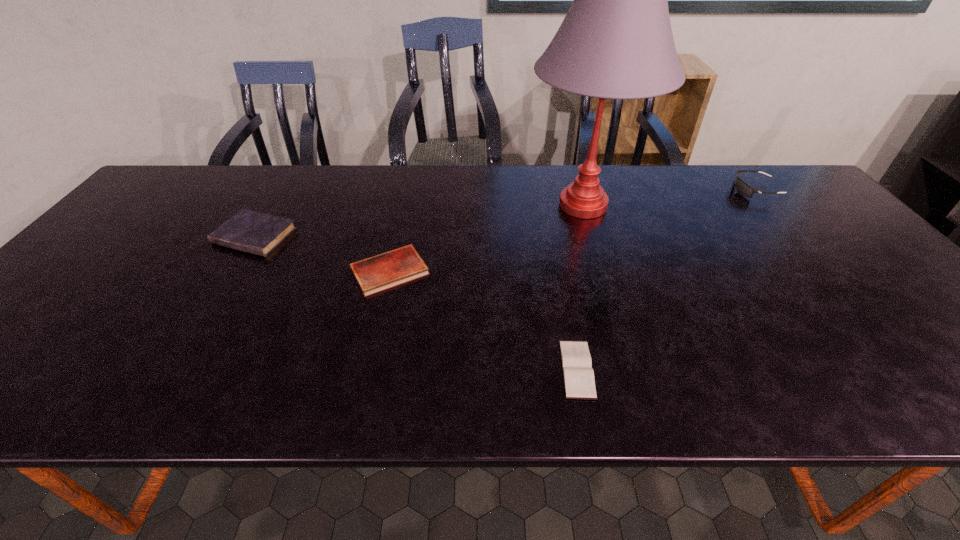
At what (x,y) coordinates should I click in order to perform the action: click on free region located on the front-facing side of the table lamp. Please return your answer as a coordinate pair (x, y). This screenshot has height=540, width=960. Looking at the image, I should click on (493, 205).

The width and height of the screenshot is (960, 540). I want to click on free spot located on the lenses of the rightmost object, so click(674, 190).

Locate an element on the screen. vacant space located 0.280m on the lenses of the rightmost object is located at coordinates (641, 190).

Where is `free space located 0.240m on the lenses of the rightmost object`? This screenshot has height=540, width=960. free space located 0.240m on the lenses of the rightmost object is located at coordinates (655, 190).

Image resolution: width=960 pixels, height=540 pixels. I want to click on free space located on the right of the tallest diary, so click(x=326, y=236).

The height and width of the screenshot is (540, 960). I want to click on vacant space located 0.390m on the left of the second diary from right to left, so click(191, 271).

Identify the location of free space located 0.320m on the left of the rightmost diary. The image size is (960, 540). (400, 369).

Locate an element on the screen. This screenshot has width=960, height=540. table lamp situated at the far edge is located at coordinates (615, 42).

Where is `goggles at the far edge`? This screenshot has height=540, width=960. goggles at the far edge is located at coordinates (743, 188).

Identify the location of object that is at the near edge. The width and height of the screenshot is (960, 540). (578, 375).